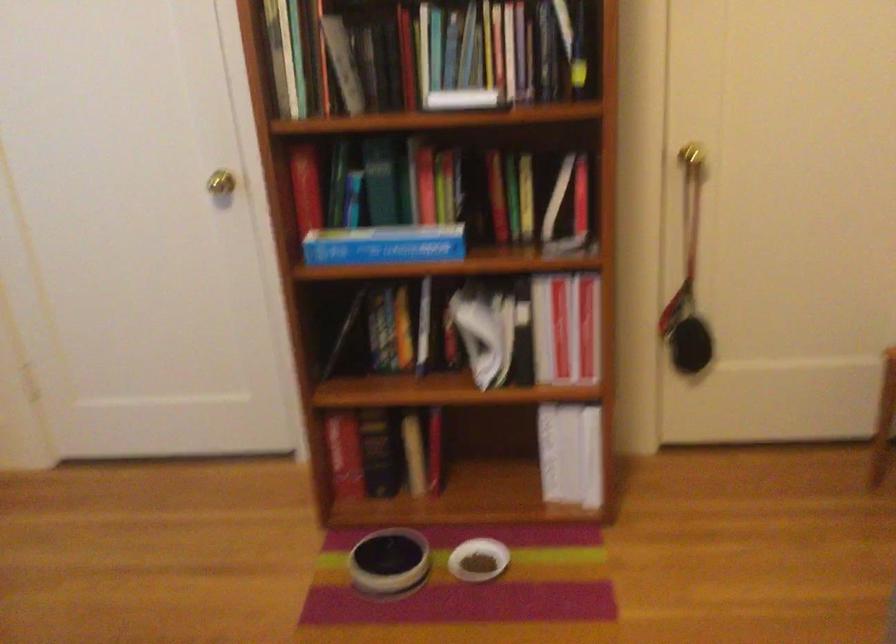
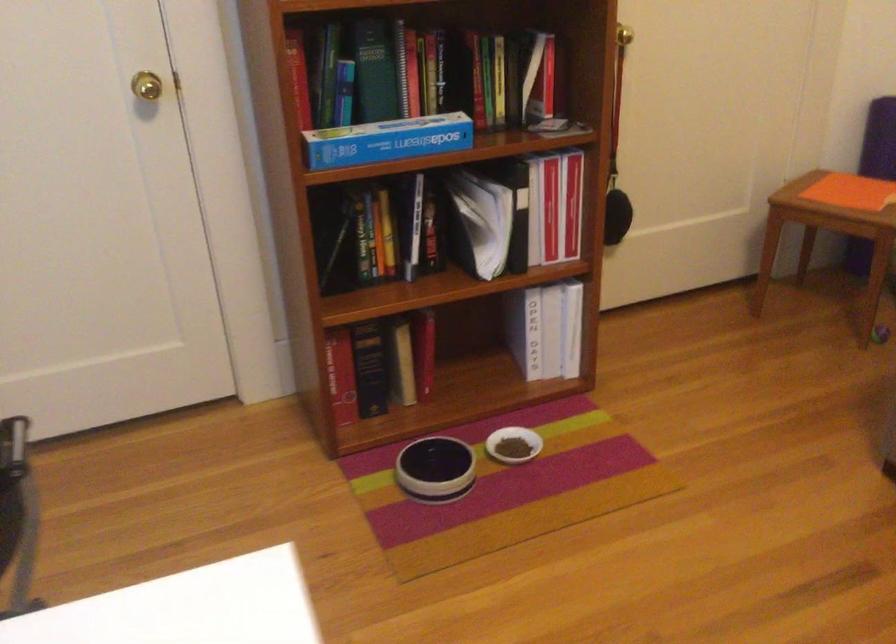
The point at (394, 565) is marked in the first image. Where is the corresponding point in the second image?

(435, 468)